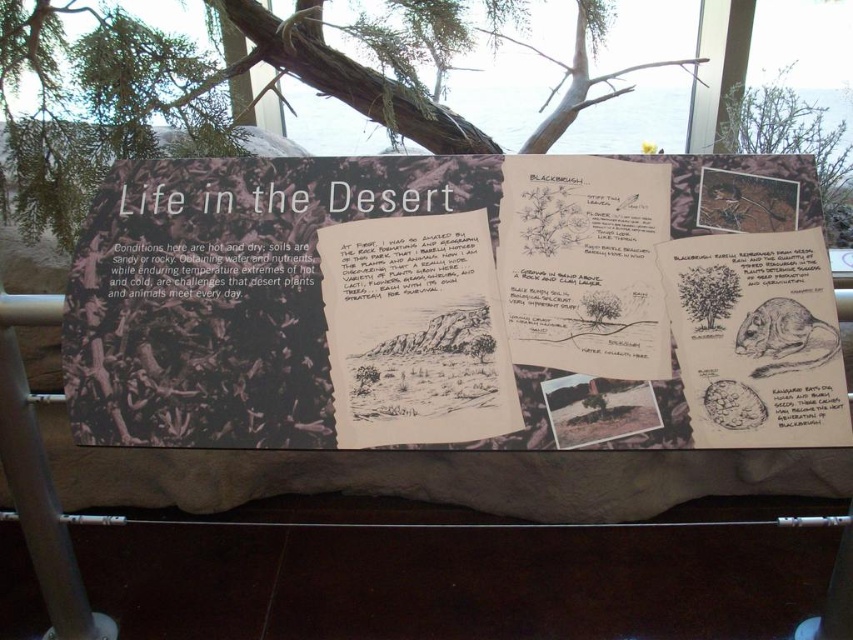
Question: Which object is positioned farthest from the black paper at lower right?

Choices:
 (A) black ink drawing of plant at center
 (B) green leafy tree at upper left
 (C) black paper text at center
 (D) brown paper sketch at center right

Answer: (B)

Question: Can you confirm if matte black signboard at center is positioned below green leafy tree at upper left?

Choices:
 (A) no
 (B) yes

Answer: (B)

Question: Among these points, which one is nearest to the camera?

Choices:
 (A) (845, 401)
 (B) (32, 179)
 (C) (750, 173)
 (D) (703, 280)

Answer: (A)

Question: Is matte black signboard at center to the left of black paper at lower right from the viewer's perspective?

Choices:
 (A) yes
 (B) no

Answer: (A)

Question: Is black paper text at center closer to the viewer compared to black paper at lower right?

Choices:
 (A) no
 (B) yes

Answer: (A)

Question: Which point appears closest to the camera in this image?

Choices:
 (A) (572, 310)
 (B) (840, 387)

Answer: (B)